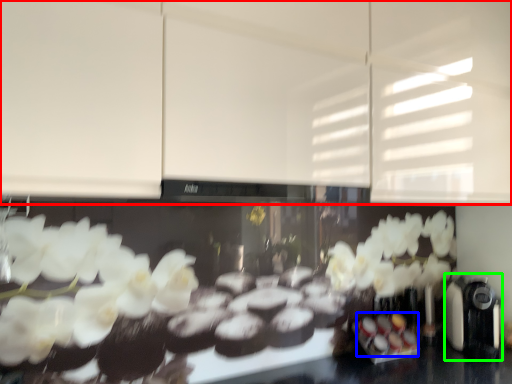
Question: Which object is positioned farthest from cabinetry (highlighted by a red box)? Select from food (highlighted by a blue box) and coffee machine (highlighted by a green box).

Choices:
 (A) food
 (B) coffee machine

Answer: (A)